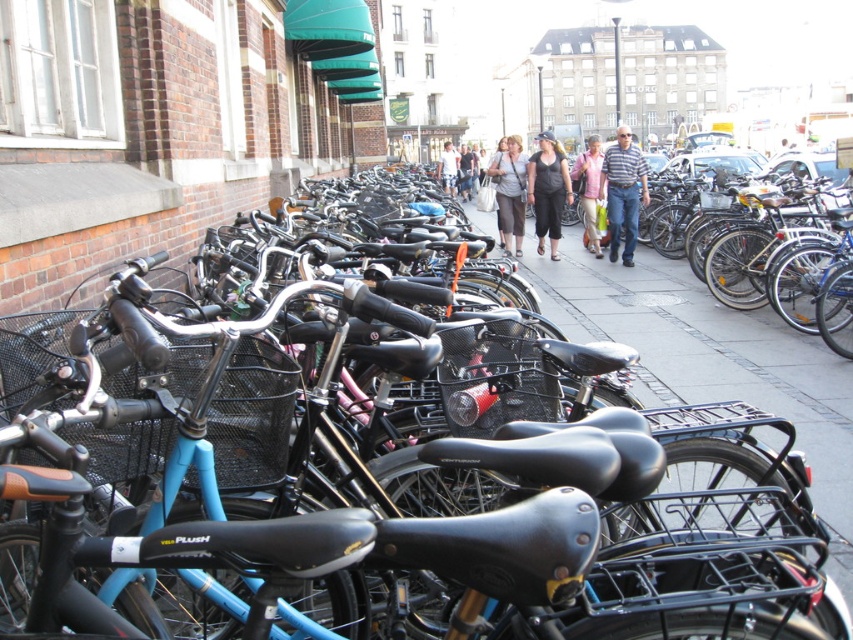
Question: Among these points, which one is farthest from the camera?

Choices:
 (A) (585, 244)
 (B) (498, 193)
 (C) (115, 380)
 (D) (445, 172)

Answer: (D)

Question: Can you confirm if gray concrete pavement at center is positioned above matte gray shirt at center?

Choices:
 (A) yes
 (B) no

Answer: (B)

Question: Can you confirm if black matte bicycle at center is bigger than light blue fabric pants at center?

Choices:
 (A) yes
 (B) no

Answer: (B)

Question: Which point is farther to the camera?

Choices:
 (A) gray concrete pavement at center
 (B) light blue shorts at center

Answer: (B)

Question: Which object is closer to the camera taking this photo?

Choices:
 (A) light blue fabric pants at center
 (B) matte gray shirt at center

Answer: (B)

Question: Is matte black pants at center above light blue fabric pants at center?

Choices:
 (A) no
 (B) yes

Answer: (A)